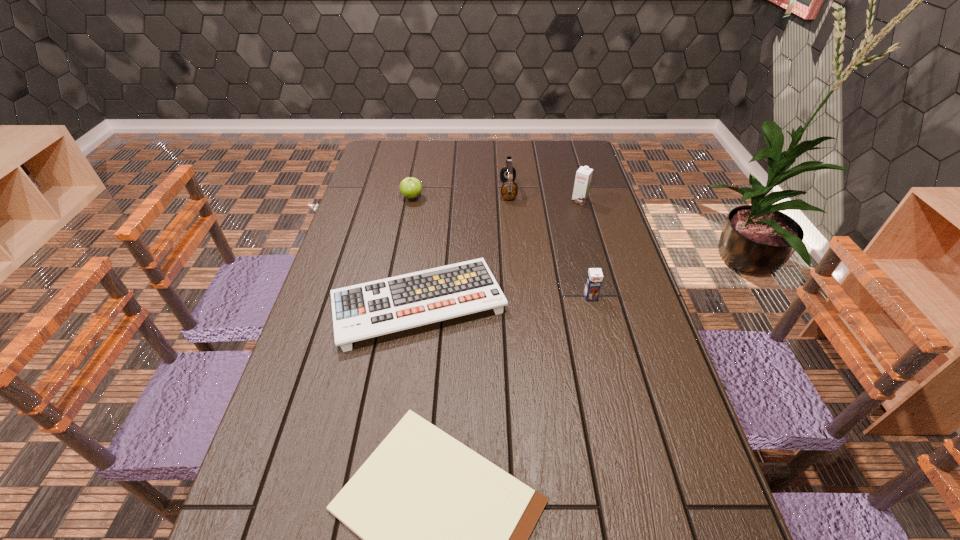
Where is `free location located 0.310m on the back of the apple`? The image size is (960, 540). free location located 0.310m on the back of the apple is located at coordinates (421, 150).

The height and width of the screenshot is (540, 960). I want to click on vacant space located 0.090m on the front of the fifth tallest object, so click(x=406, y=384).

The width and height of the screenshot is (960, 540). I want to click on object that is at the left edge, so click(x=376, y=308).

The height and width of the screenshot is (540, 960). What are the coordinates of `vacant space at the far edge of the desktop` in the screenshot? It's located at (506, 144).

Image resolution: width=960 pixels, height=540 pixels. I want to click on vacant space at the left edge of the desktop, so click(x=315, y=426).

Locate an element on the screen. This screenshot has width=960, height=540. free point at the right edge is located at coordinates (571, 176).

Identify the location of empty space between the headset and the shorter chocolate milk. (549, 244).

You are a GUI agent. You are given a task and a screenshot of the screen. Output one action in this format:
    pyautogui.click(x=<x>, y=<y>)
    Task: Click on the vacant space in between the nearer chocolate milk and the headset
    
    Given the screenshot: What is the action you would take?
    pyautogui.click(x=549, y=244)

Locate an element on the screen. The width and height of the screenshot is (960, 540). unoccupied area between the taller chocolate milk and the apple is located at coordinates (495, 199).

This screenshot has height=540, width=960. Identify the location of free spot between the apple and the computer keyboard. (415, 250).